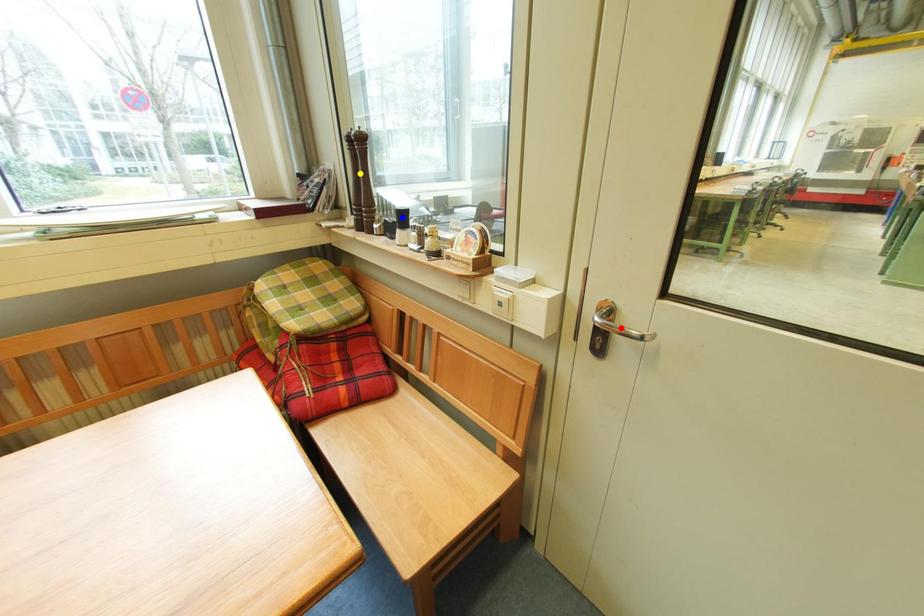
Order these from nearest to farthest:
red point | yellow point | blue point

red point → blue point → yellow point